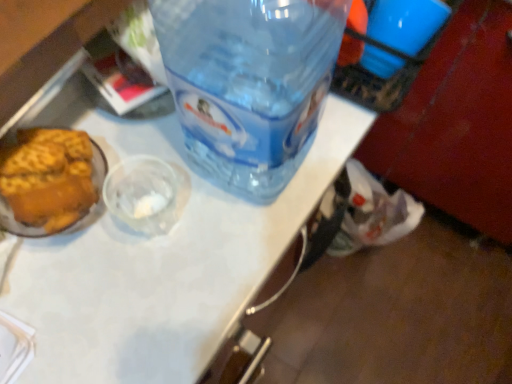
Question: From the image's perspective, relative to transparent plastic table at center, is transparent plastic bottle at center above or below?

Choices:
 (A) below
 (B) above

Answer: (B)

Question: Considering the positions of transparent plastic bottle at center and transparent plastic table at center in the image, is transparent plastic bottle at center taller or shorter than transparent plastic table at center?

Choices:
 (A) short
 (B) tall

Answer: (A)

Question: In terms of width, does transparent plastic bottle at center look wider or thinner when compared to transparent plastic table at center?

Choices:
 (A) wide
 (B) thin

Answer: (B)

Question: From the image's perspective, is transparent plastic table at center above or below transparent plastic bottle at center?

Choices:
 (A) above
 (B) below

Answer: (B)

Question: From a real-world perspective, relative to transparent plastic bottle at center, is transparent plastic table at center vertically above or below?

Choices:
 (A) below
 (B) above

Answer: (A)

Question: In terms of width, does transparent plastic table at center look wider or thinner when compared to transparent plastic bottle at center?

Choices:
 (A) wide
 (B) thin

Answer: (A)

Question: Is transparent plastic table at center bigger or smaller than transparent plastic bottle at center?

Choices:
 (A) big
 (B) small

Answer: (A)